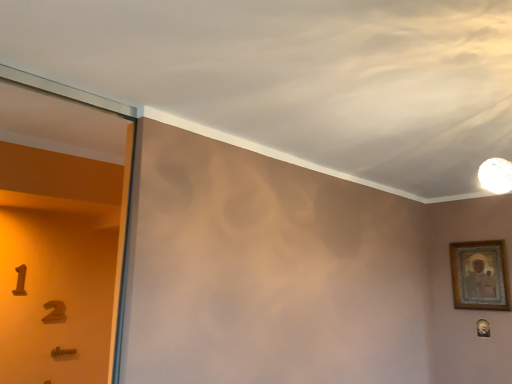
Question: Is gold-framed painting at right, the first picture frame from the top, looking in the opposite direction of gold-framed portrait at lower right, placed as the 2th picture frame when sorted from top to bottom?

Choices:
 (A) no
 (B) yes

Answer: (A)

Question: Considering the relative sizes of gold-framed painting at right, the first picture frame from the top, and gold-framed portrait at lower right, arranged as the 1th picture frame when ordered from the bottom, in the image provided, is gold-framed painting at right, the first picture frame from the top, shorter than gold-framed portrait at lower right, arranged as the 1th picture frame when ordered from the bottom,?

Choices:
 (A) no
 (B) yes

Answer: (A)

Question: Can you confirm if gold-framed painting at right, which appears as the 2th picture frame when ordered from the bottom, is wider than gold-framed portrait at lower right, arranged as the 1th picture frame when ordered from the bottom?

Choices:
 (A) no
 (B) yes

Answer: (B)

Question: From a real-world perspective, is gold-framed painting at right, the first picture frame from the top, physically below gold-framed portrait at lower right, placed as the 2th picture frame when sorted from top to bottom?

Choices:
 (A) yes
 (B) no

Answer: (B)

Question: Considering the relative positions of gold-framed painting at right, which appears as the 2th picture frame when ordered from the bottom, and gold-framed portrait at lower right, arranged as the 1th picture frame when ordered from the bottom, in the image provided, is gold-framed painting at right, which appears as the 2th picture frame when ordered from the bottom, to the left of gold-framed portrait at lower right, arranged as the 1th picture frame when ordered from the bottom, from the viewer's perspective?

Choices:
 (A) no
 (B) yes

Answer: (B)

Question: Is gold-framed painting at right, which appears as the 2th picture frame when ordered from the bottom, to the right of gold-framed portrait at lower right, arranged as the 1th picture frame when ordered from the bottom, from the viewer's perspective?

Choices:
 (A) no
 (B) yes

Answer: (A)

Question: Is gold-framed portrait at lower right, placed as the 2th picture frame when sorted from top to bottom, completely or partially outside of gold-framed painting at right, the first picture frame from the top?

Choices:
 (A) no
 (B) yes

Answer: (B)

Question: Is gold-framed portrait at lower right, placed as the 2th picture frame when sorted from top to bottom, aimed at gold-framed painting at right, the first picture frame from the top?

Choices:
 (A) yes
 (B) no

Answer: (B)

Question: Does gold-framed portrait at lower right, placed as the 2th picture frame when sorted from top to bottom, have a larger size compared to gold-framed painting at right, the first picture frame from the top?

Choices:
 (A) no
 (B) yes

Answer: (A)

Question: Considering the relative positions of gold-framed portrait at lower right, arranged as the 1th picture frame when ordered from the bottom, and gold-framed painting at right, which appears as the 2th picture frame when ordered from the bottom, in the image provided, is gold-framed portrait at lower right, arranged as the 1th picture frame when ordered from the bottom, to the right of gold-framed painting at right, which appears as the 2th picture frame when ordered from the bottom, from the viewer's perspective?

Choices:
 (A) yes
 (B) no

Answer: (A)

Question: Is the surface of gold-framed portrait at lower right, arranged as the 1th picture frame when ordered from the bottom, in direct contact with gold-framed painting at right, the first picture frame from the top?

Choices:
 (A) yes
 (B) no

Answer: (B)

Question: Is the position of gold-framed portrait at lower right, placed as the 2th picture frame when sorted from top to bottom, less distant than that of gold-framed painting at right, which appears as the 2th picture frame when ordered from the bottom?

Choices:
 (A) no
 (B) yes

Answer: (A)

Question: From a real-world perspective, is gold-framed painting at right, which appears as the 2th picture frame when ordered from the bottom, positioned above or below gold-framed portrait at lower right, arranged as the 1th picture frame when ordered from the bottom?

Choices:
 (A) below
 (B) above

Answer: (B)